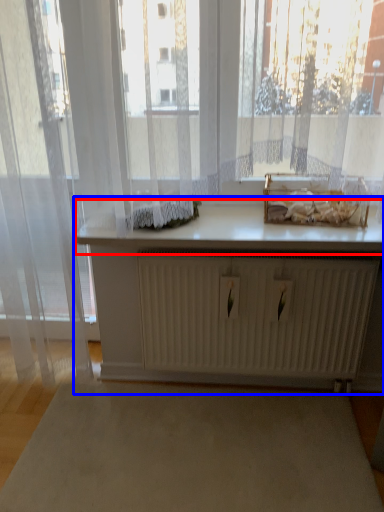
Question: Which object is further to the camera taking this photo, counter top (highlighted by a red box) or table (highlighted by a blue box)?

Choices:
 (A) counter top
 (B) table

Answer: (B)